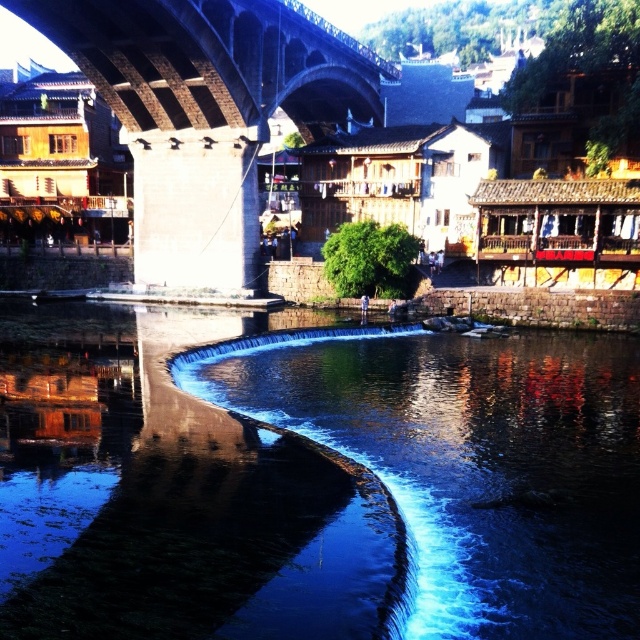
Is point (106, 426) positioned after point (250, 209)?

No, it is not.

Who is more distant from viewer, (262, 556) or (189, 141)?

The point (189, 141) is behind.

Which is in front, point (218, 396) or point (156, 209)?

Point (218, 396) is in front.

The width and height of the screenshot is (640, 640). What are the coordinates of `blue smooth water at center` in the screenshot? It's located at coord(170,492).